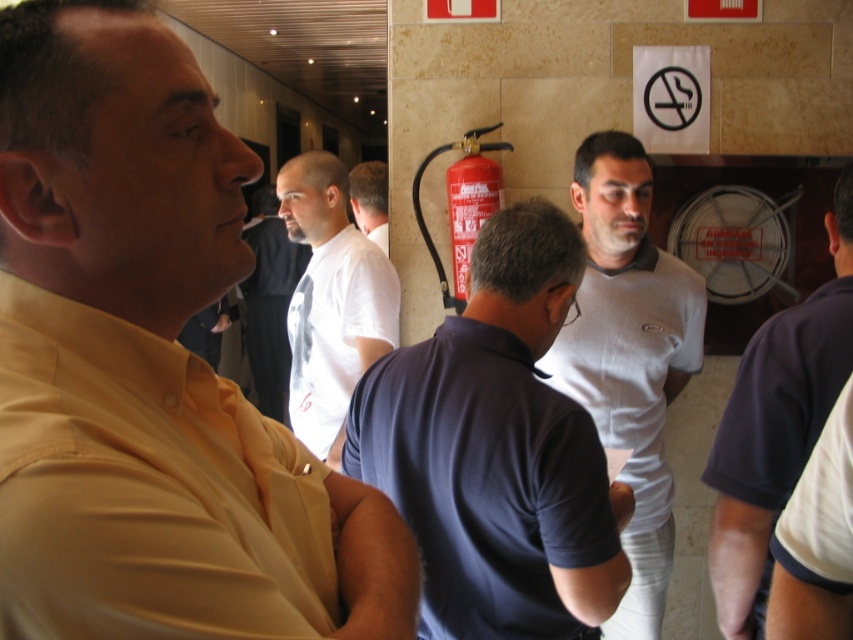
You are a security guard in the hallway and need to identify which person is closer to you. You see a dark blue polo shirt at center and a dark blue fabric shirt at right. Which one is closer?

The dark blue polo shirt at center is closer because it is in front of the dark blue fabric shirt at right.

You are standing at the point marked by the coordinates point (776, 428) in the image. Looking around, you see a man in a light yellow shirt and others in casual attire. Which direction should you turn to face the dark blue fabric shirt at right?

The point (776, 428) corresponds to the dark blue fabric shirt at right, so you are already facing it.

You are a painter who needs to paint the wall behind the white cotton shirt at center and the red matte fire extinguisher at center. Which object requires a larger area of paint because it is wider?

The white cotton shirt at center requires a larger area of paint because its width surpasses that of the red matte fire extinguisher at center.